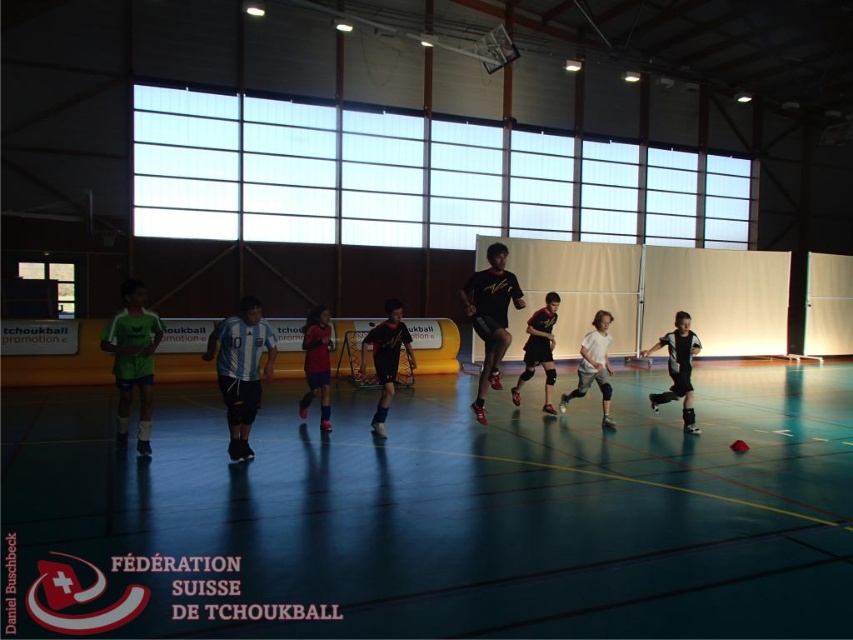
Question: Which point is closer to the camera taking this photo?

Choices:
 (A) (395, 356)
 (B) (677, 336)
 (C) (158, 609)
 (D) (592, 358)

Answer: (C)

Question: Which of the following is the farthest from the observer?

Choices:
 (A) (497, 243)
 (B) (573, 387)
 (C) (724, 387)
 (D) (374, 364)

Answer: (C)

Question: Which is farther from the green rubber basketball court at center?

Choices:
 (A) black matte jersey at center
 (B) black jersey at center
 (C) matte black shorts at center

Answer: (A)

Question: Is black matte jersey at center wider than white matte shirt at center?

Choices:
 (A) no
 (B) yes

Answer: (A)

Question: Is the position of green rubber basketball court at center less distant than that of white matte shirt at center?

Choices:
 (A) no
 (B) yes

Answer: (B)

Question: Is blue and white striped jersey at center to the right of white matte shirt at center from the viewer's perspective?

Choices:
 (A) no
 (B) yes

Answer: (A)